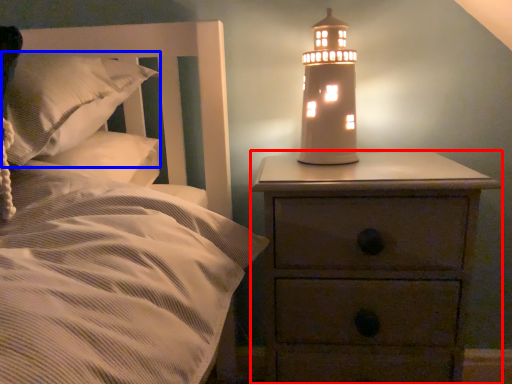
Question: Among these objects, which one is nearest to the camera, nightstand (highlighted by a red box) or pillow (highlighted by a blue box)?

Choices:
 (A) nightstand
 (B) pillow

Answer: (B)